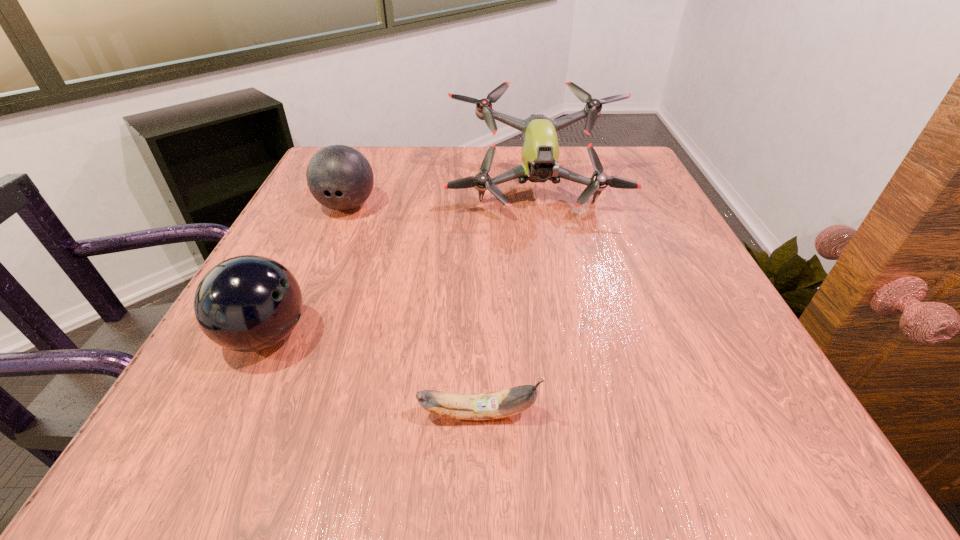
The height and width of the screenshot is (540, 960). I want to click on bowling ball positioned at the far edge, so click(x=339, y=177).

This screenshot has width=960, height=540. What are the coordinates of `object present at the near edge` in the screenshot? It's located at pyautogui.click(x=483, y=406).

I want to click on object that is at the right edge, so click(540, 149).

Find the location of a particular element. The image size is (960, 540). object at the far left corner is located at coordinates (339, 177).

This screenshot has width=960, height=540. Find the location of `object at the far right corner`. object at the far right corner is located at coordinates [x=540, y=149].

Locate an element on the screen. This screenshot has height=540, width=960. free space at the far edge of the desktop is located at coordinates (401, 167).

In the image, there is a desktop. Find the location of `blank space at the near edge`. blank space at the near edge is located at coordinates (439, 417).

In order to click on free space at the left edge of the desktop in this screenshot , I will do `click(290, 253)`.

In the image, there is a desktop. Identify the location of free space at the right edge. tap(612, 249).

Where is `vacant space at the far left corner of the desktop`? vacant space at the far left corner of the desktop is located at coordinates (379, 151).